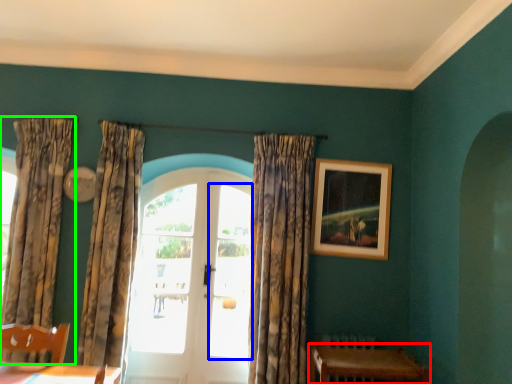
Question: Based on their relative distances, which object is farther from table (highlighted by a red box)? Choose from window (highlighted by a blue box) and curtain (highlighted by a green box).

Choices:
 (A) window
 (B) curtain

Answer: (B)